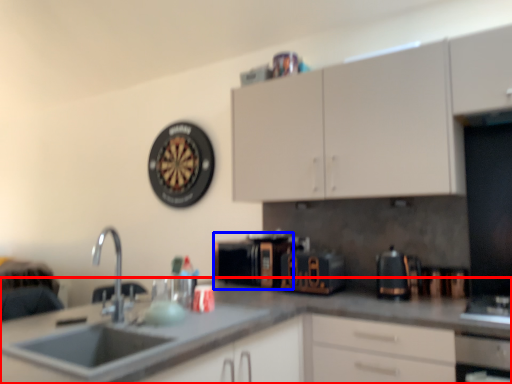
Question: Which point is further to the camera, countertop (highlighted by a red box) or appliance (highlighted by a blue box)?

Choices:
 (A) countertop
 (B) appliance

Answer: (B)